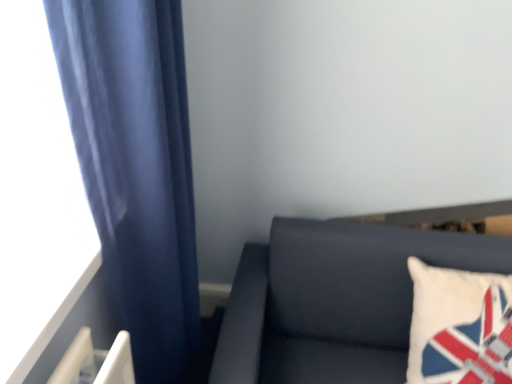
Question: Considering their positions, is dark gray fabric couch at lower right located in front of or behind satin blue curtain at left?

Choices:
 (A) behind
 (B) front

Answer: (A)

Question: Which is correct: dark gray fabric couch at lower right is inside satin blue curtain at left, or outside of it?

Choices:
 (A) outside
 (B) inside

Answer: (A)

Question: Estimate the real-world distances between objects in this image. Which object is closer to the white fabric pillow at right?

Choices:
 (A) satin blue curtain at left
 (B) dark gray fabric couch at lower right

Answer: (B)

Question: Considering the real-world distances, which object is closest to the satin blue curtain at left?

Choices:
 (A) dark gray fabric couch at lower right
 (B) white fabric pillow at right

Answer: (A)